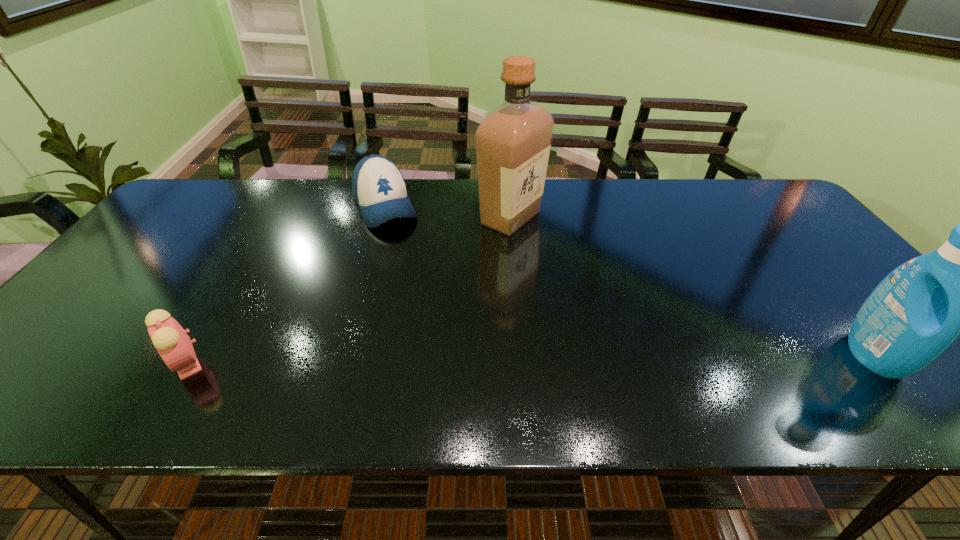
The height and width of the screenshot is (540, 960). I want to click on alarm clock, so click(x=172, y=342).

Where is `the second tallest object`? The width and height of the screenshot is (960, 540). the second tallest object is located at coordinates (919, 310).

In order to click on detergent in this screenshot , I will do `click(919, 310)`.

Find the location of a particular element. This screenshot has width=960, height=540. liquor is located at coordinates (513, 142).

Locate an element on the screen. the tallest object is located at coordinates (513, 142).

Find the location of a particular element. This screenshot has width=960, height=540. baseball cap is located at coordinates (379, 189).

Where is `free space located on the face of the leftmost object`? This screenshot has width=960, height=540. free space located on the face of the leftmost object is located at coordinates (131, 363).

Find the location of a particular element. free space located on the face of the leftmost object is located at coordinates (33, 363).

You are a GUI agent. You are given a task and a screenshot of the screen. Output one action in this format:
    pyautogui.click(x=<x>, y=<y>)
    Task: Click on the blank area located 0.150m on the face of the leftmost object
    This screenshot has width=960, height=540.
    Given the screenshot: What is the action you would take?
    pyautogui.click(x=93, y=363)

The width and height of the screenshot is (960, 540). Identify the location of free space located on the front-facing side of the detergent. (926, 355).